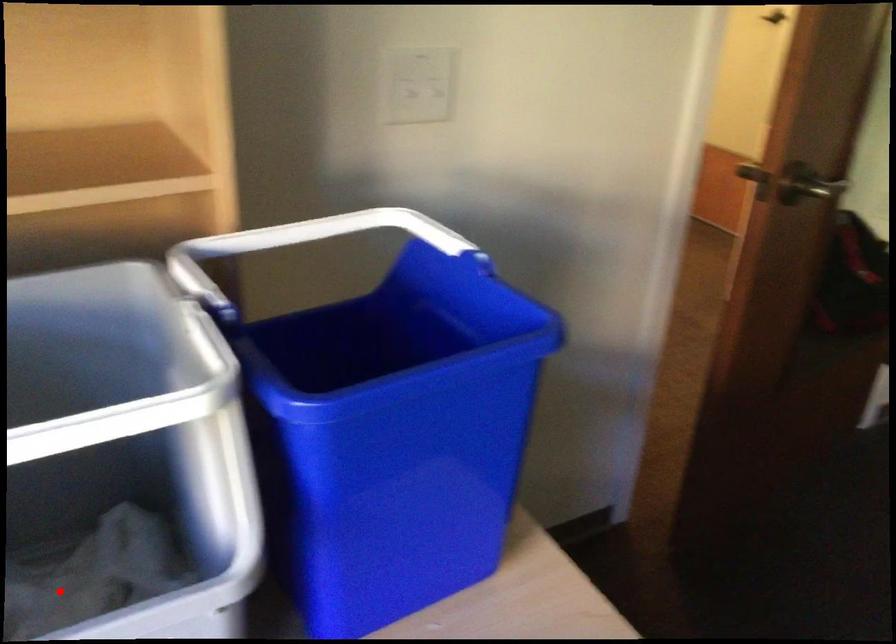
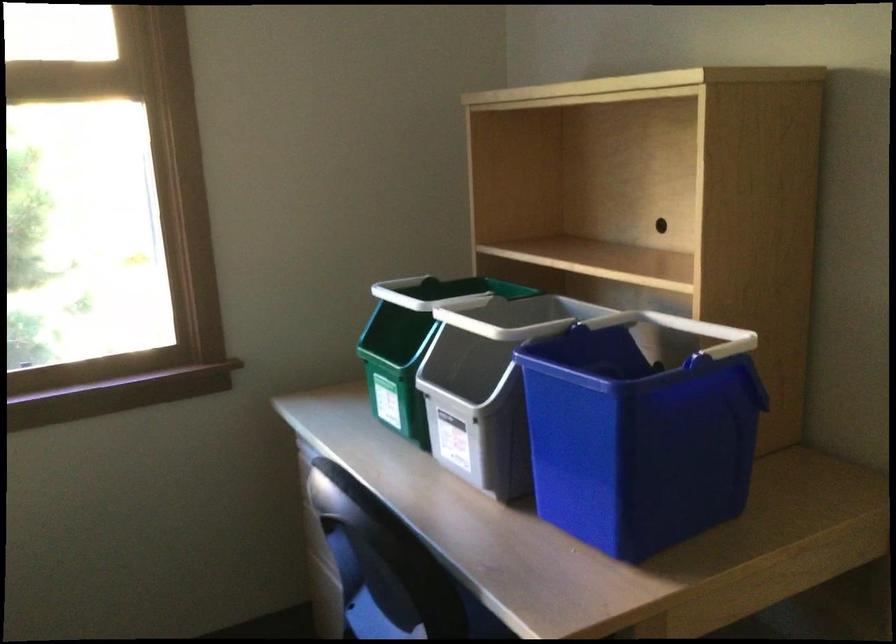
Question: I am providing you with two images of the same scene from different viewpoints. A red point is marked on the first image. At the location where the point appears in image 1, is it still visible in image 2?

Choices:
 (A) Yes
 (B) No

Answer: (B)